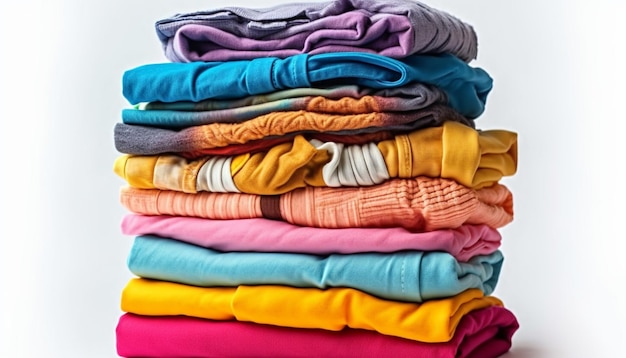
Identify the location of folded clothing. This screenshot has width=626, height=358. (163, 339), (198, 304), (198, 272), (250, 234), (218, 204), (233, 170), (202, 138), (216, 72), (221, 47), (255, 25).